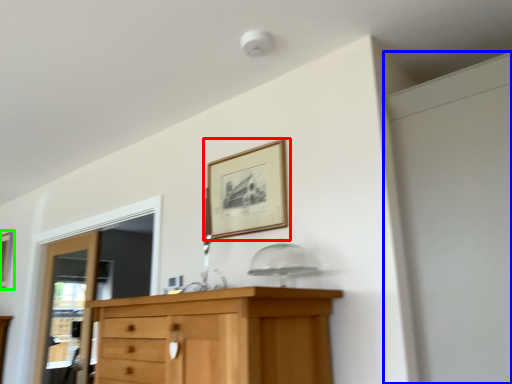
Question: Which is nearer to the picture frame (highlighted by a red box)? screen door (highlighted by a blue box) or picture frame (highlighted by a green box).

Choices:
 (A) screen door
 (B) picture frame

Answer: (A)